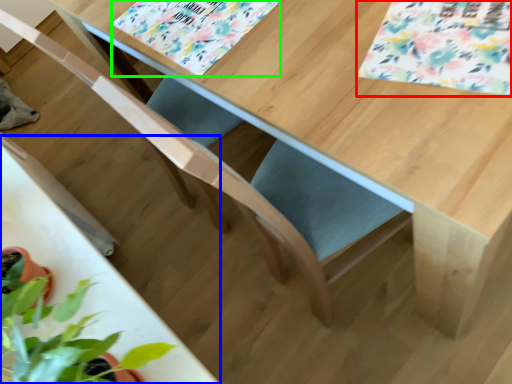
Question: Which is farther away from flower (highlighted by a red box)? round table (highlighted by a blue box) or flower (highlighted by a green box)?

Choices:
 (A) round table
 (B) flower

Answer: (A)